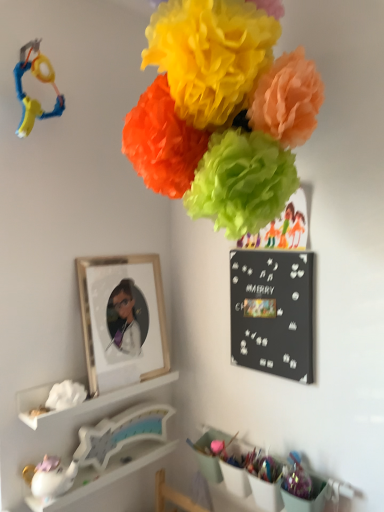
Question: Considering the relative sizes of white fluffy tissue at lower left, the first flower from the bottom, and blue plastic toy at upper left, the first toy when ordered from top to bottom, in the image provided, is white fluffy tissue at lower left, the first flower from the bottom, smaller than blue plastic toy at upper left, the first toy when ordered from top to bottom,?

Choices:
 (A) yes
 (B) no

Answer: (A)

Question: Are white fluffy tissue at lower left, the first flower from the bottom, and blue plastic toy at upper left, the first toy when ordered from top to bottom, beside each other?

Choices:
 (A) no
 (B) yes

Answer: (A)

Question: From the image's perspective, is white fluffy tissue at lower left, the first flower from the bottom, on blue plastic toy at upper left, the first toy when ordered from top to bottom?

Choices:
 (A) no
 (B) yes

Answer: (A)

Question: From the image's perspective, is white fluffy tissue at lower left, placed as the 2th flower when sorted from front to back, below blue plastic toy at upper left, which ranks as the 2th toy in bottom-to-top order?

Choices:
 (A) yes
 (B) no

Answer: (A)

Question: Does white fluffy tissue at lower left, arranged as the first flower when viewed from the back, have a larger size compared to blue plastic toy at upper left, the first toy when ordered from top to bottom?

Choices:
 (A) no
 (B) yes

Answer: (A)

Question: From a real-world perspective, is white glossy unicorn at lower left, which is the 1th shelf from bottom to top, physically located above or below white fluffy tissue at lower left, which ranks as the second flower in right-to-left order?

Choices:
 (A) above
 (B) below

Answer: (B)

Question: Is white glossy unicorn at lower left, which is the 1th shelf from bottom to top, in front of or behind white fluffy tissue at lower left, which ranks as the second flower in right-to-left order, in the image?

Choices:
 (A) behind
 (B) front

Answer: (B)

Question: Based on their positions, is white glossy unicorn at lower left, the third shelf from the top, located to the left or right of white fluffy tissue at lower left, arranged as the first flower when viewed from the back?

Choices:
 (A) left
 (B) right

Answer: (B)

Question: Based on their sizes in the image, would you say white glossy unicorn at lower left, which is the 1th shelf from bottom to top, is bigger or smaller than white fluffy tissue at lower left, the 1th flower when ordered from left to right?

Choices:
 (A) small
 (B) big

Answer: (B)

Question: Is white glossy unicorn at lower left, which is the 1th shelf from bottom to top, in front of or behind wooden picture frame at lower left in the image?

Choices:
 (A) behind
 (B) front

Answer: (B)

Question: From the image's perspective, is white glossy unicorn at lower left, which is the 1th shelf from bottom to top, positioned above or below wooden picture frame at lower left?

Choices:
 (A) above
 (B) below

Answer: (B)

Question: Do you think white glossy unicorn at lower left, the third shelf from the top, is within wooden picture frame at lower left, or outside of it?

Choices:
 (A) outside
 (B) inside

Answer: (A)

Question: From a real-world perspective, is white glossy unicorn at lower left, the third shelf from the top, positioned above or below wooden picture frame at lower left?

Choices:
 (A) below
 (B) above

Answer: (A)

Question: From a real-world perspective, relative to white matte tissue box at lower left, the 3th shelf positioned from the bottom, is white fluffy tissue at lower left, the 1th flower when ordered from left to right, vertically above or below?

Choices:
 (A) above
 (B) below

Answer: (A)

Question: Does point (66, 388) appear closer or farther from the camera than point (153, 380)?

Choices:
 (A) farther
 (B) closer

Answer: (B)